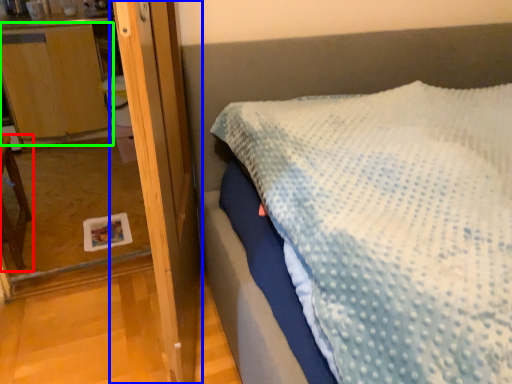
Question: Which object is positioned farthest from furniture (highlighted by a red box)? Select from screen door (highlighted by a blue box) and dresser (highlighted by a green box).

Choices:
 (A) screen door
 (B) dresser

Answer: (A)